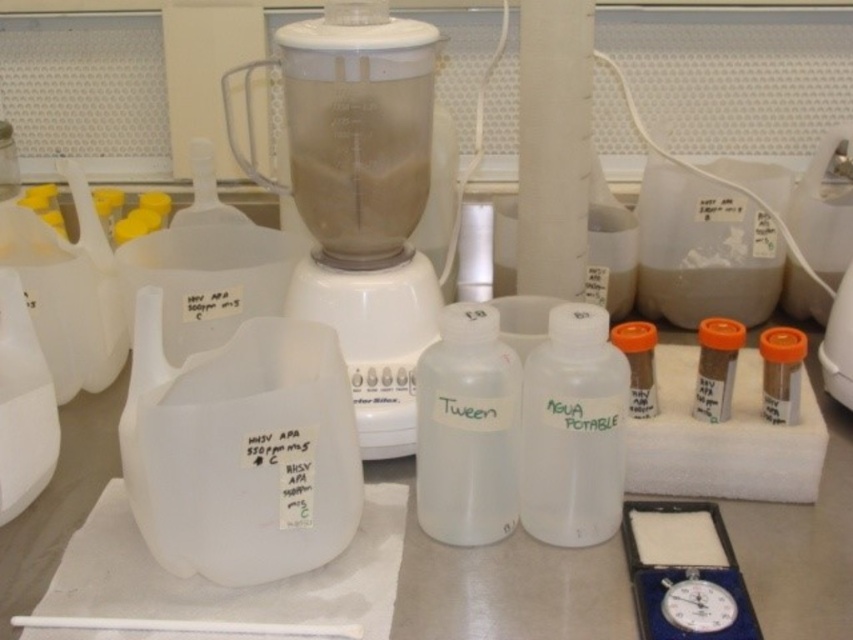
Question: Which object is closer to the camera taking this photo?

Choices:
 (A) brown matte vial at center-right
 (B) transparent plastic bottle at center
 (C) white plastic blender at center

Answer: (B)

Question: Can you confirm if white matte bottle at center is positioned to the right of brown matte vial at center-right?

Choices:
 (A) yes
 (B) no

Answer: (B)

Question: Which of the following is the closest to the observer?

Choices:
 (A) white plastic blender at center
 (B) brown matte vial at center-right

Answer: (A)

Question: Is white plastic blender at center smaller than transparent plastic bottle at center?

Choices:
 (A) no
 (B) yes

Answer: (A)

Question: Which of the following is the farthest from the observer?

Choices:
 (A) white matte bottle at center
 (B) transparent plastic bottle at center

Answer: (B)

Question: Does transparent plastic bottle at center appear on the left side of brown matte vial at center-right?

Choices:
 (A) no
 (B) yes

Answer: (B)